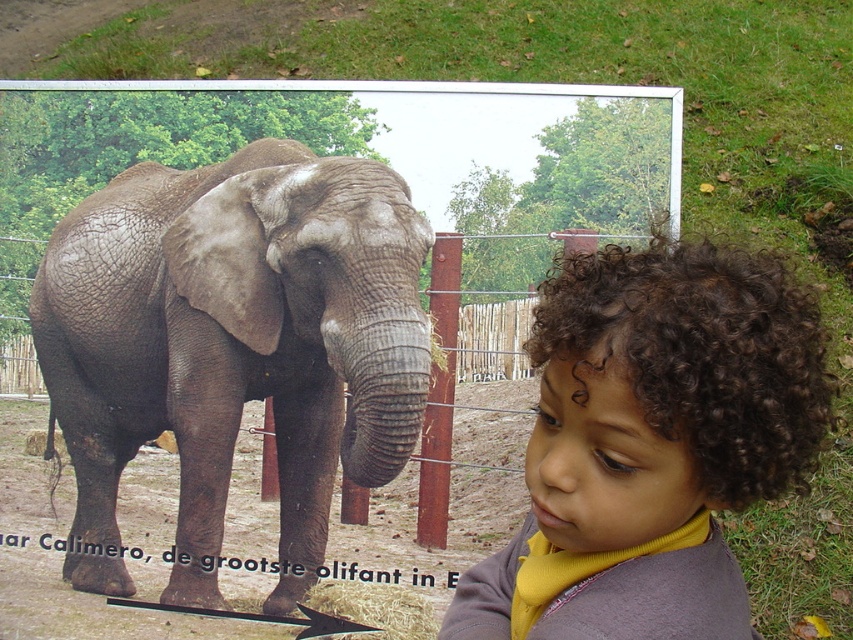
Is gray textured elephant at center taller than brown wooden fence at center?

Yes.

Is gray textured elephant at center bigger than brown wooden fence at center?

Correct, gray textured elephant at center is larger in size than brown wooden fence at center.

Identify the location of gray textured elephant at center. This screenshot has height=640, width=853. click(x=231, y=346).

Between gray textured elephant at center and curly brown hair at lower right, which one has more height?

gray textured elephant at center is taller.

Is gray textured elephant at center to the right of curly brown hair at lower right from the viewer's perspective?

Incorrect, gray textured elephant at center is not on the right side of curly brown hair at lower right.

The width and height of the screenshot is (853, 640). I want to click on gray textured elephant at center, so click(231, 346).

Identify the location of gray textured elephant at center. This screenshot has width=853, height=640. (231, 346).

Is curly brown hair at lower right behind brown wooden fence at center?

That is False.

Does curly brown hair at lower right appear on the right side of brown wooden fence at center?

Yes, curly brown hair at lower right is to the right of brown wooden fence at center.

Is point (699, 296) positioned behind point (436, 250)?

No, (699, 296) is in front of (436, 250).

Where is `curly brown hair at lower right`? curly brown hair at lower right is located at coordinates (656, 436).